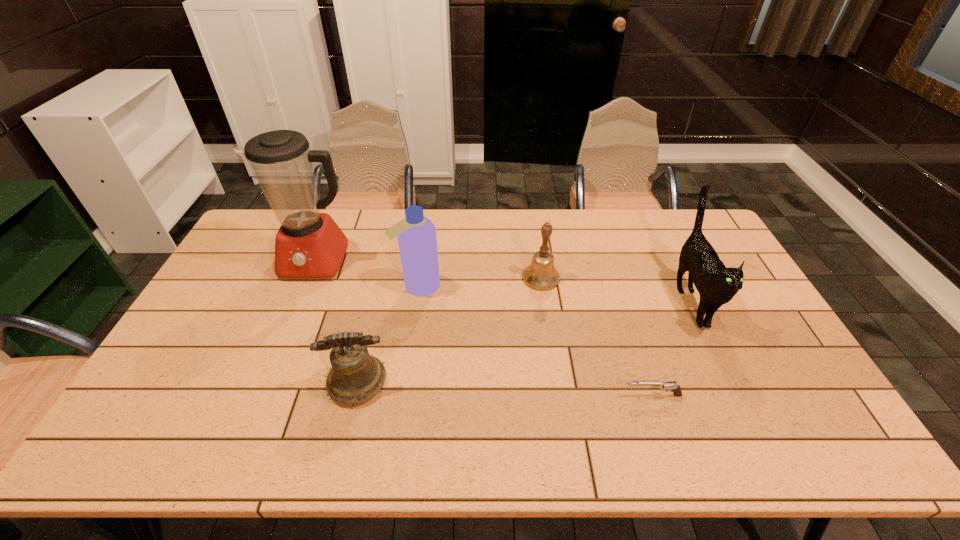
Find the location of a particular element. This screenshot has height=540, width=960. free space between the third shortest object and the shorter bell is located at coordinates (449, 330).

Where is `empty space between the shorter bell and the rightmost object`? The width and height of the screenshot is (960, 540). empty space between the shorter bell and the rightmost object is located at coordinates (524, 341).

At what (x,y) coordinates should I click in order to perform the action: click on free space between the left bell and the rightmost object. Please return your answer as a coordinate pair (x, y). This screenshot has height=540, width=960. Looking at the image, I should click on (524, 341).

Find the location of `vacant space in between the fourth object from left to right and the left bell`. vacant space in between the fourth object from left to right and the left bell is located at coordinates (449, 330).

Identify the location of vacant point located between the second object from right to left and the shorter bell. (505, 389).

At what (x,y) coordinates should I click in order to perform the action: click on object identified as the fourth closest to the tallest object. Please return your answer as a coordinate pair (x, y). Looking at the image, I should click on (675, 388).

Where is `object that is the fifth nearest to the taller bell`? This screenshot has width=960, height=540. object that is the fifth nearest to the taller bell is located at coordinates (309, 244).

The height and width of the screenshot is (540, 960). What are the coordinates of `free space that satisfies the following two spatial constraints: 1. on the front of the tallest object near the controls; 2. on the right side of the right bell` in the screenshot? It's located at (309, 278).

This screenshot has height=540, width=960. In order to click on vacant space that satisfies the following two spatial constraints: 1. on the back side of the left bell; 2. on the left side of the farther bell in this screenshot , I will do `click(382, 278)`.